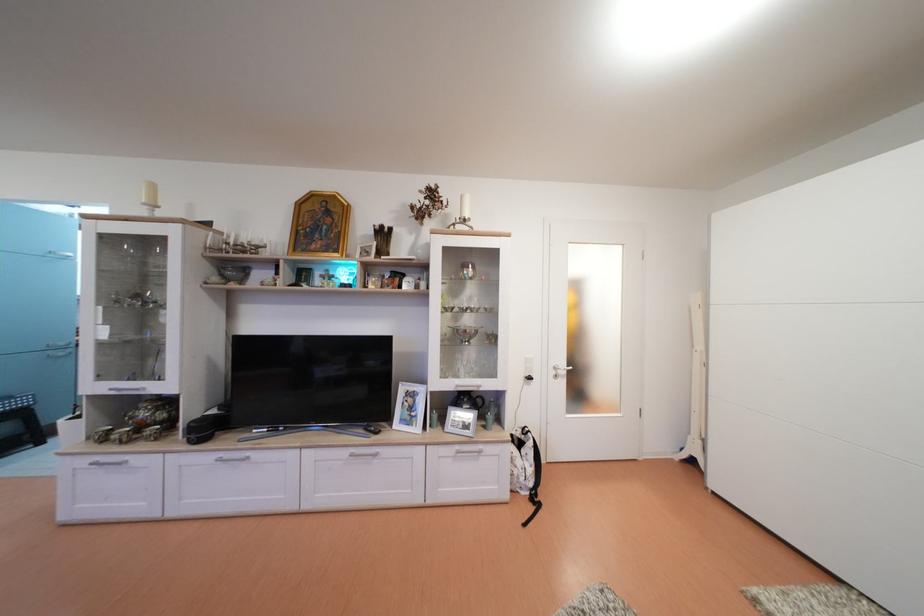
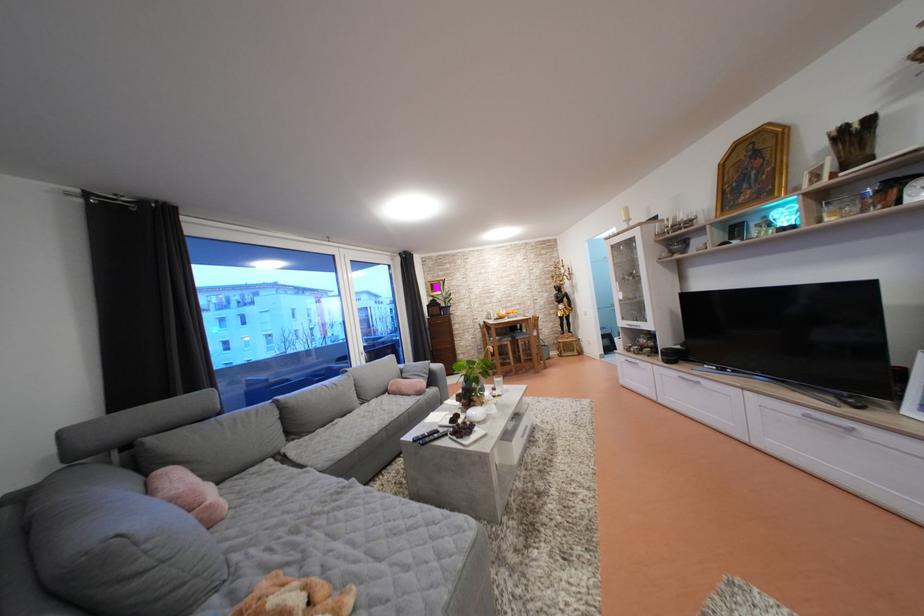
In the second image, find the point that corresponds to the point at 106,382 in the first image.

(629, 323)